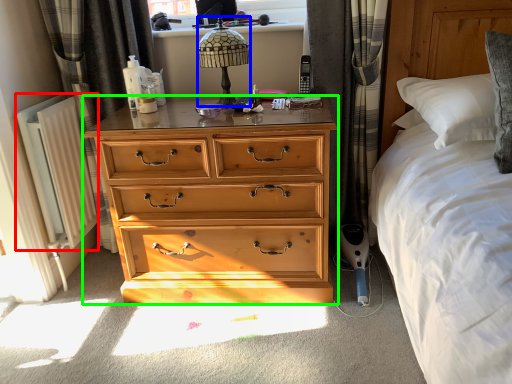
Question: Based on their relative distances, which object is nearer to radiator (highlighted by a red box)? Choose from lamp (highlighted by a blue box) and chest of drawers (highlighted by a green box).

Choices:
 (A) lamp
 (B) chest of drawers

Answer: (B)